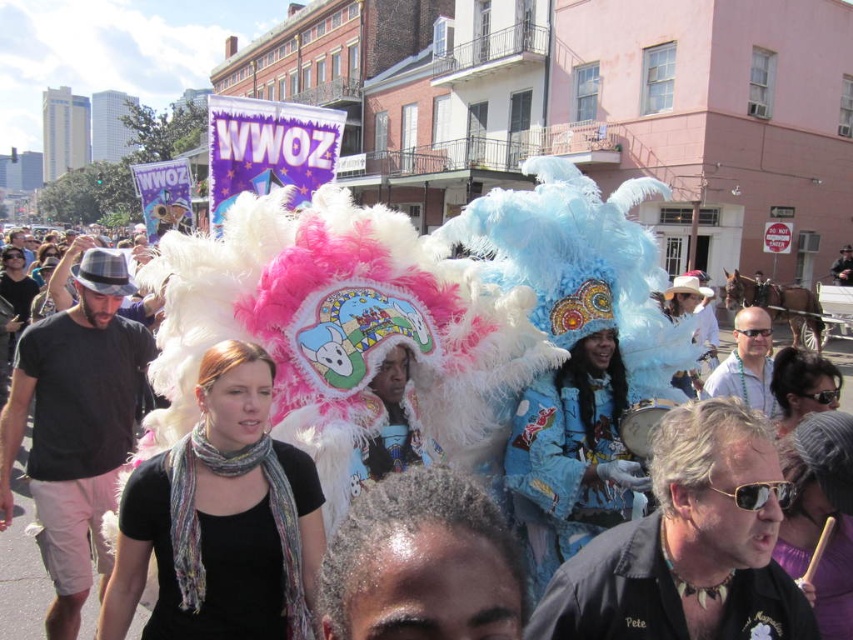
You are a photographer trying to capture both the black scarf at center and the feathered headdress at center in a single frame. Which object appears larger in the scene?

The feathered headdress at center appears larger than the black scarf at center in the scene.

You are a photographer trying to capture both the feathered headdress at center and the multicolored feather headdress at center in a single frame. Which headdress should you adjust your camera to focus on first to ensure both are in the shot?

The feathered headdress at center is positioned on the left side of multicolored feather headdress at center, so you should focus on the multicolored feather headdress at center first as it is on the right, allowing you to frame both by adjusting from right to left.